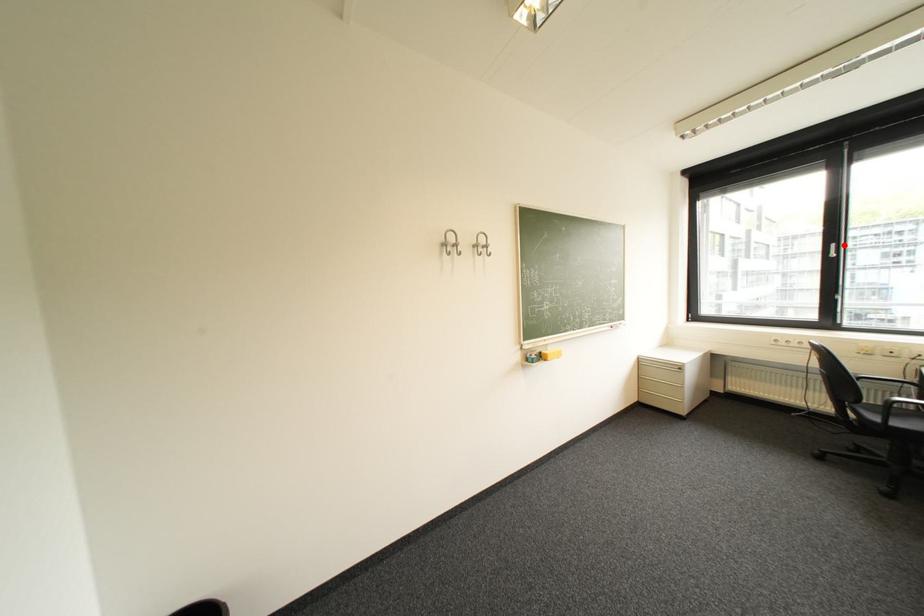
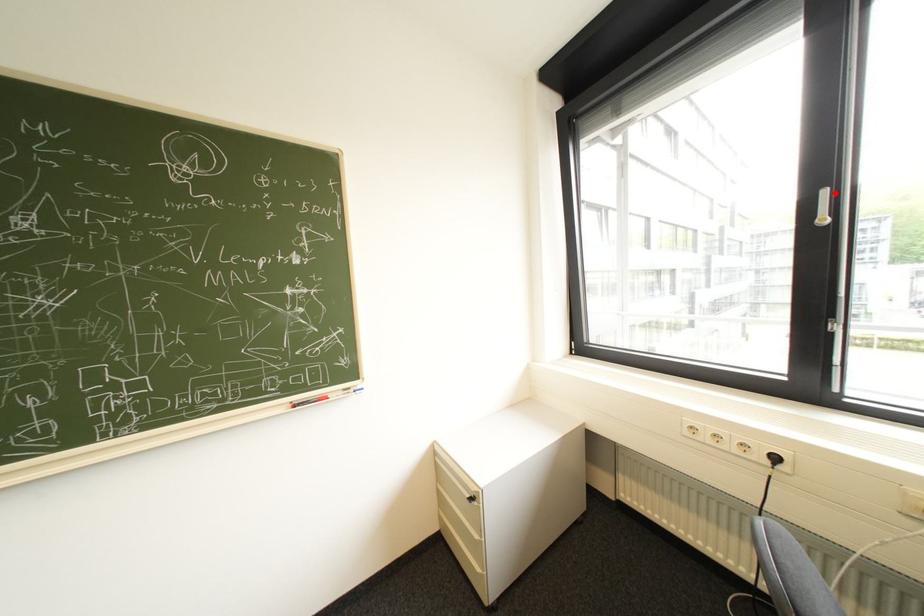
I am providing you with two images of the same scene from different viewpoints. A red point is marked on the first image and another point is marked on the second image. Is the red point in image1 aligned with the point shown in image2?

Yes